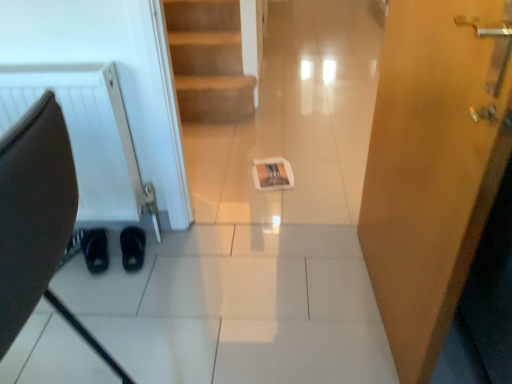
Where is `free space to the back side of wooden door at right`? The image size is (512, 384). free space to the back side of wooden door at right is located at coordinates (323, 225).